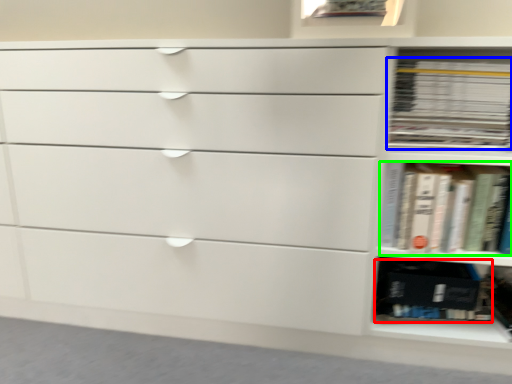
Question: Which object is the closest to the paperback book (highlighted by a red box)? Choose among these: book (highlighted by a blue box) or book (highlighted by a green box).

Choices:
 (A) book
 (B) book

Answer: (B)